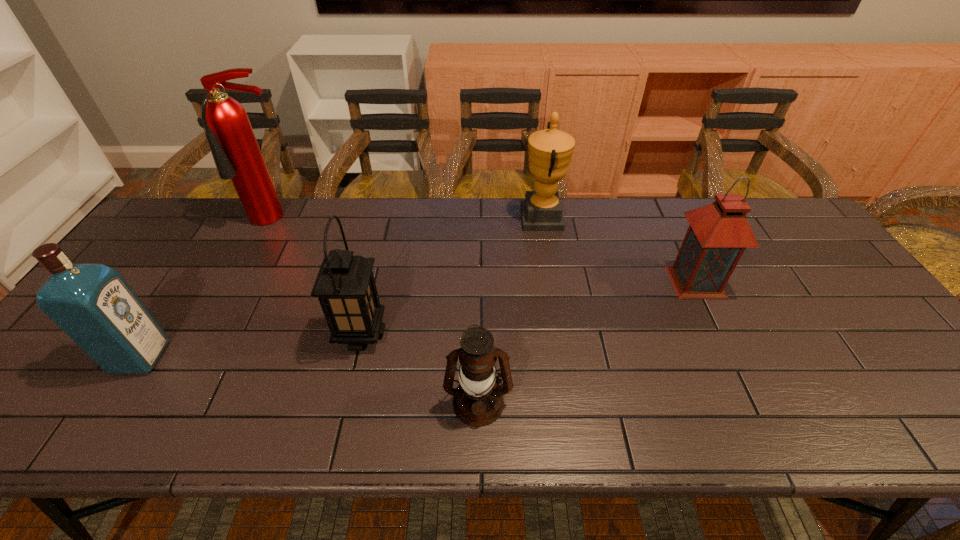
Where is `vacant area situated at the nozzle of the fifth object from right to left`? This screenshot has width=960, height=540. vacant area situated at the nozzle of the fifth object from right to left is located at coordinates (237, 291).

At what (x,y) coordinates should I click in order to perform the action: click on vacant space located 0.200m at the front of the second object from right to left with handles. Please return your answer as a coordinate pair (x, y). This screenshot has width=960, height=540. Looking at the image, I should click on (460, 218).

Locate an element on the screen. This screenshot has width=960, height=540. free point located 0.210m at the front of the second object from right to left with handles is located at coordinates (456, 218).

Locate an element on the screen. free region located 0.060m at the front of the second object from right to left with handles is located at coordinates (x=503, y=218).

This screenshot has width=960, height=540. I want to click on free location located on the left of the leftmost lantern, so click(204, 334).

Identify the location of free location located 0.070m on the flat label side of the liquor. (192, 357).

Locate an element on the screen. free space located on the back of the farthest lantern is located at coordinates (682, 252).

The image size is (960, 540). Identify the location of fire extinguisher present at the far edge. click(x=236, y=153).

Find the location of `award situated at the far edge`. award situated at the far edge is located at coordinates (550, 150).

The height and width of the screenshot is (540, 960). I want to click on object present at the near edge, so click(x=478, y=401).